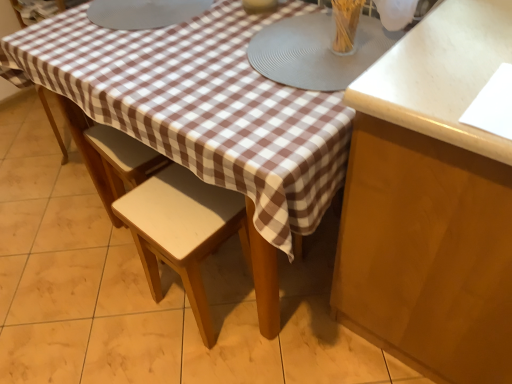
Image resolution: width=512 pixels, height=384 pixels. Describe the element at coordinates (345, 24) in the screenshot. I see `clear glass vase at upper center` at that location.

What do you see at coordinates (182, 231) in the screenshot? I see `light beige wood stool at center` at bounding box center [182, 231].

Find the location of a particular element. The width and height of the screenshot is (512, 384). clear glass vase at upper center is located at coordinates (345, 24).

Does light beige wood stool at center turn towards clear glass vase at upper center?

No, light beige wood stool at center does not turn towards clear glass vase at upper center.

Considering the positions of objects light beige wood stool at center and clear glass vase at upper center in the image provided, who is more to the left, light beige wood stool at center or clear glass vase at upper center?

Positioned to the left is light beige wood stool at center.

Considering the sizes of objects light beige wood stool at center and clear glass vase at upper center in the image provided, who is wider, light beige wood stool at center or clear glass vase at upper center?

light beige wood stool at center.

Between matte gray placemat at center, which is the 1th round table from right to left, and matte gray plate at upper center, which is the second round table from right to left, which one has smaller size?

matte gray placemat at center, which is the 1th round table from right to left.

Does matte gray placemat at center, the second round table from the left, have a lesser height compared to matte gray plate at upper center, which appears as the 1th round table when viewed from the left?

Incorrect, the height of matte gray placemat at center, the second round table from the left, does not fall short of that of matte gray plate at upper center, which appears as the 1th round table when viewed from the left.

Considering the relative sizes of matte gray placemat at center, the second round table from the left, and matte gray plate at upper center, which appears as the 1th round table when viewed from the left, in the image provided, is matte gray placemat at center, the second round table from the left, wider than matte gray plate at upper center, which appears as the 1th round table when viewed from the left,?

Yes.

In terms of width, does clear glass vase at upper center look wider or thinner when compared to matte brown cabinet at right?

In the image, clear glass vase at upper center appears to be more narrow than matte brown cabinet at right.

Which object is closer to the camera, clear glass vase at upper center or matte brown cabinet at right?

Positioned in front is matte brown cabinet at right.

What's the angular difference between clear glass vase at upper center and matte brown cabinet at right's facing directions?

They differ by 2.09 degrees in their facing directions.

From the image's perspective, between clear glass vase at upper center and matte brown cabinet at right, which one is located above?

clear glass vase at upper center.

From the image's perspective, which one is positioned higher, matte brown cabinet at right or matte gray plate at upper center, which is the second round table from right to left?

matte gray plate at upper center, which is the second round table from right to left, from the image's perspective.

Which is in front, point (462, 37) or point (210, 3)?

The point (462, 37) is more forward.

Can you tell me how much matte brown cabinet at right and matte gray plate at upper center, which appears as the 1th round table when viewed from the left, differ in facing direction?

0.000186 degrees separate the facing orientations of matte brown cabinet at right and matte gray plate at upper center, which appears as the 1th round table when viewed from the left.

Can you confirm if matte brown cabinet at right is positioned to the left of matte gray plate at upper center, which is the second round table from right to left?

No.

Is point (297, 16) closer or farther from the camera than point (391, 161)?

Point (297, 16) appears to be farther away from the viewer than point (391, 161).

Find the location of a particular element. The image size is (512, 384). round table that is the 2nd one above the matte brown cabinet at right (from a real-world perspective) is located at coordinates (317, 51).

Considering the positions of objects matte gray placemat at center, which is the 1th round table from right to left, and matte brown cabinet at right in the image provided, who is in front, matte gray placemat at center, which is the 1th round table from right to left, or matte brown cabinet at right?

matte brown cabinet at right is in front.

What's the angular difference between matte gray placemat at center, which is the 1th round table from right to left, and clear glass vase at upper center's facing directions?

There is a 2.09-degree angle between the facing directions of matte gray placemat at center, which is the 1th round table from right to left, and clear glass vase at upper center.

Which is further, (341, 60) or (339, 2)?

Positioned behind is point (341, 60).

Considering the relative sizes of matte gray placemat at center, which is the 1th round table from right to left, and clear glass vase at upper center in the image provided, is matte gray placemat at center, which is the 1th round table from right to left, thinner than clear glass vase at upper center?

No.

Between matte gray placemat at center, which is the 1th round table from right to left, and clear glass vase at upper center, which one appears on the right side from the viewer's perspective?

clear glass vase at upper center is more to the right.

Which is more to the right, matte brown cabinet at right or light beige wood stool at center?

matte brown cabinet at right.

Is matte brown cabinet at right outside of light beige wood stool at center?

matte brown cabinet at right is positioned outside light beige wood stool at center.

From a real-world perspective, is matte brown cabinet at right positioned over light beige wood stool at center based on gravity?

Yes, from a real-world perspective, matte brown cabinet at right is above light beige wood stool at center.

Is matte brown cabinet at right turned away from light beige wood stool at center?

No, matte brown cabinet at right is not facing the opposite direction of light beige wood stool at center.

This screenshot has width=512, height=384. Identify the location of stool below the clear glass vase at upper center (from a real-world perspective). (182, 231).

At what (x,y) coordinates should I click in order to perform the action: click on round table above the matte gray plate at upper center, which appears as the 1th round table when viewed from the left (from a real-world perspective). Please return your answer as a coordinate pair (x, y). The height and width of the screenshot is (384, 512). Looking at the image, I should click on (317, 51).

Looking at this image, when comparing their distances from matte gray placemat at center, the second round table from the left, does matte brown cabinet at right or clear glass vase at upper center seem further?

matte brown cabinet at right is positioned further to the anchor matte gray placemat at center, the second round table from the left.

When comparing their distances from matte gray placemat at center, the second round table from the left, does matte gray plate at upper center, which appears as the 1th round table when viewed from the left, or light beige wood stool at center seem closer?

matte gray plate at upper center, which appears as the 1th round table when viewed from the left, lies closer to matte gray placemat at center, the second round table from the left, than the other object.

From the image, which object appears to be nearer to matte brown cabinet at right, light beige wood stool at center or matte gray plate at upper center, which is the second round table from right to left?

light beige wood stool at center.

Looking at the image, which one is located closer to matte gray placemat at center, which is the 1th round table from right to left, light beige wood stool at center or matte gray plate at upper center, which appears as the 1th round table when viewed from the left?

The object closer to matte gray placemat at center, which is the 1th round table from right to left, is matte gray plate at upper center, which appears as the 1th round table when viewed from the left.

Which object lies nearer to the anchor point matte gray plate at upper center, which is the second round table from right to left, clear glass vase at upper center or matte brown cabinet at right?

clear glass vase at upper center is closer to matte gray plate at upper center, which is the second round table from right to left.

Based on the photo, looking at the image, which one is located further to clear glass vase at upper center, light beige wood stool at center or matte brown cabinet at right?

A: Among the two, light beige wood stool at center is located further to clear glass vase at upper center.

Estimate the real-world distances between objects in this image. Which object is further from matte brown cabinet at right, matte gray plate at upper center, which is the second round table from right to left, or matte gray placemat at center, which is the 1th round table from right to left?

Among the two, matte gray plate at upper center, which is the second round table from right to left, is located further to matte brown cabinet at right.

From the image, which object appears to be farther from matte brown cabinet at right, matte gray plate at upper center, which appears as the 1th round table when viewed from the left, or clear glass vase at upper center?

Based on the image, matte gray plate at upper center, which appears as the 1th round table when viewed from the left, appears to be further to matte brown cabinet at right.

At what (x,y) coordinates should I click in order to perform the action: click on tableware between matte gray plate at upper center, which is the second round table from right to left, and light beige wood stool at center vertically. Please return your answer as a coordinate pair (x, y). This screenshot has height=384, width=512. Looking at the image, I should click on (345, 24).

At what (x,y) coordinates should I click in order to perform the action: click on round table between light beige wood stool at center and matte brown cabinet at right from left to right. Please return your answer as a coordinate pair (x, y). Looking at the image, I should click on (317, 51).

Where is `stool situated between matte gray plate at upper center, which is the second round table from right to left, and matte brown cabinet at right from left to right`? The height and width of the screenshot is (384, 512). stool situated between matte gray plate at upper center, which is the second round table from right to left, and matte brown cabinet at right from left to right is located at coordinates (182, 231).

The image size is (512, 384). Find the location of `round table between matte gray plate at upper center, which appears as the 1th round table when viewed from the left, and light beige wood stool at center, in the vertical direction`. round table between matte gray plate at upper center, which appears as the 1th round table when viewed from the left, and light beige wood stool at center, in the vertical direction is located at coordinates (317, 51).